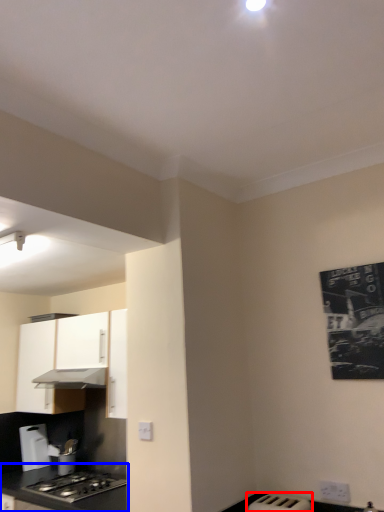
Question: Which of the following is the farthest to the observer, appliance (highlighted by a red box) or countertop (highlighted by a blue box)?

Choices:
 (A) appliance
 (B) countertop

Answer: (B)